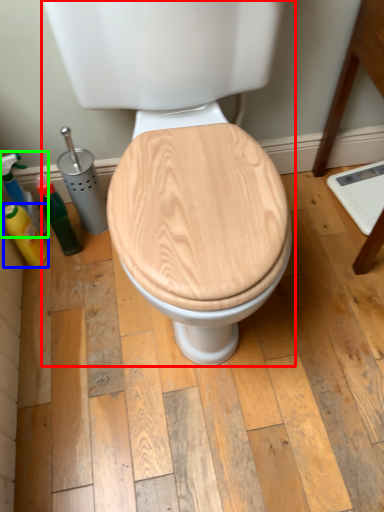
Question: Based on their relative distances, which object is nearer to toilet (highlighted by a red box)? Choose from cleaning product (highlighted by a blue box) and cleaning product (highlighted by a green box).

Choices:
 (A) cleaning product
 (B) cleaning product

Answer: (B)